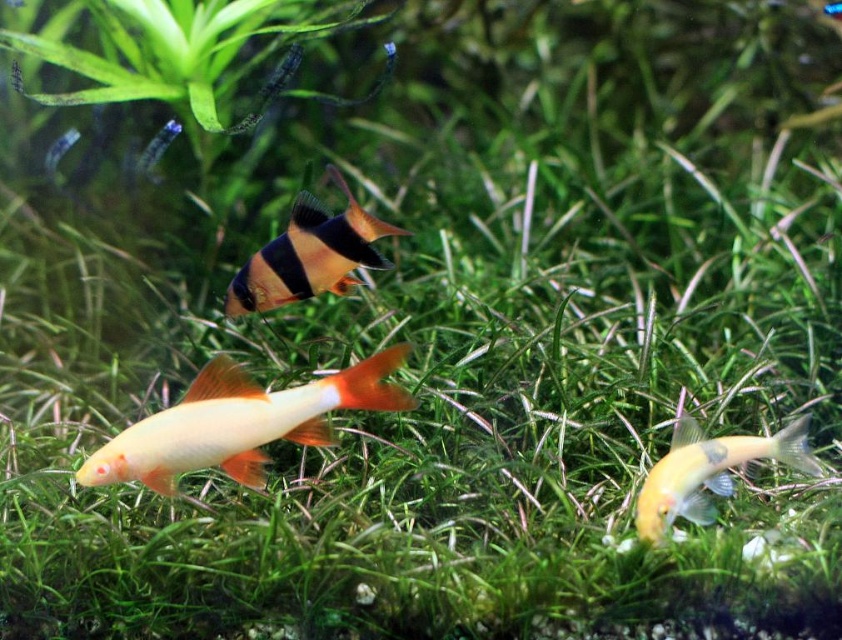
Question: Which point is closer to the camera?

Choices:
 (A) black and orange striped fish at center
 (B) shiny orange fish at center
 (C) shiny yellow fish at lower right

Answer: (B)

Question: Does shiny orange fish at center appear on the right side of black and orange striped fish at center?

Choices:
 (A) no
 (B) yes

Answer: (A)

Question: Is shiny orange fish at center smaller than black and orange striped fish at center?

Choices:
 (A) yes
 (B) no

Answer: (B)

Question: Which of the following is the closest to the observer?

Choices:
 (A) shiny orange fish at center
 (B) black and orange striped fish at center

Answer: (A)

Question: Is black and orange striped fish at center below shiny yellow fish at lower right?

Choices:
 (A) no
 (B) yes

Answer: (A)

Question: Among these objects, which one is nearest to the camera?

Choices:
 (A) shiny yellow fish at lower right
 (B) black and orange striped fish at center
 (C) shiny orange fish at center

Answer: (C)